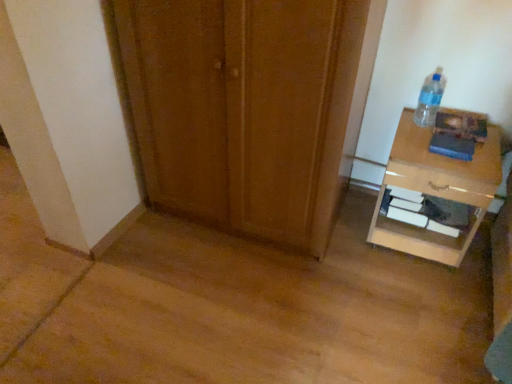
Identify the location of free space in front of wooden door at center. (247, 305).